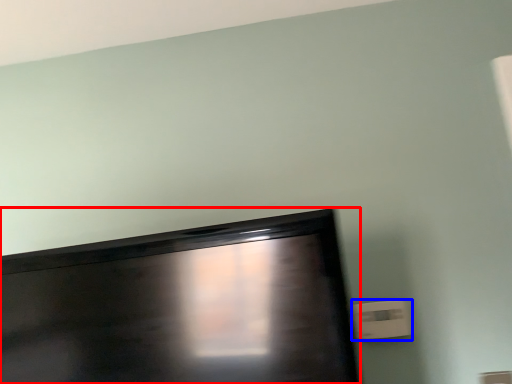
Question: Which point is further to the camera, television (highlighted by a red box) or electric outlet (highlighted by a blue box)?

Choices:
 (A) television
 (B) electric outlet

Answer: (B)